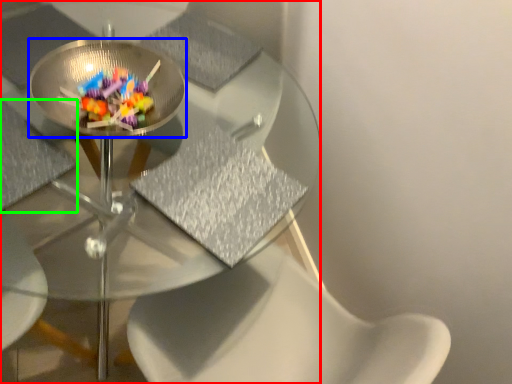
Question: Which object is the closest to the table (highlighted by a red box)? Choose among these: glass plate (highlighted by a blue box) or chair (highlighted by a green box).

Choices:
 (A) glass plate
 (B) chair

Answer: (A)